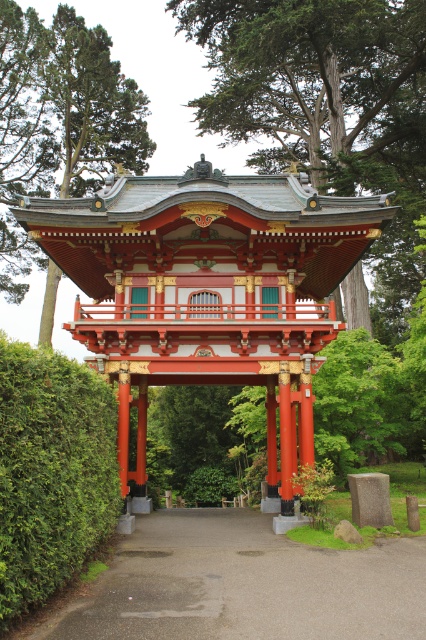
You are standing at the entrance of the torii gate and see the green textured tree at center and the green leafy hedge at left. Which object is positioned to the right of the other?

The green textured tree at center is positioned to the right of the green leafy hedge at left.

structural integrity of the torii gate is crucial for visitors to pass through safely. Given that the green textured tree at center and the green textured tree at upper center are both near the torii, which tree is closer to the gate and might pose a potential safety hazard if it were to fall?

The green textured tree at upper center is closer to the torii gate than the green textured tree at center, so it is the one that might pose a potential safety hazard if it were to fall.